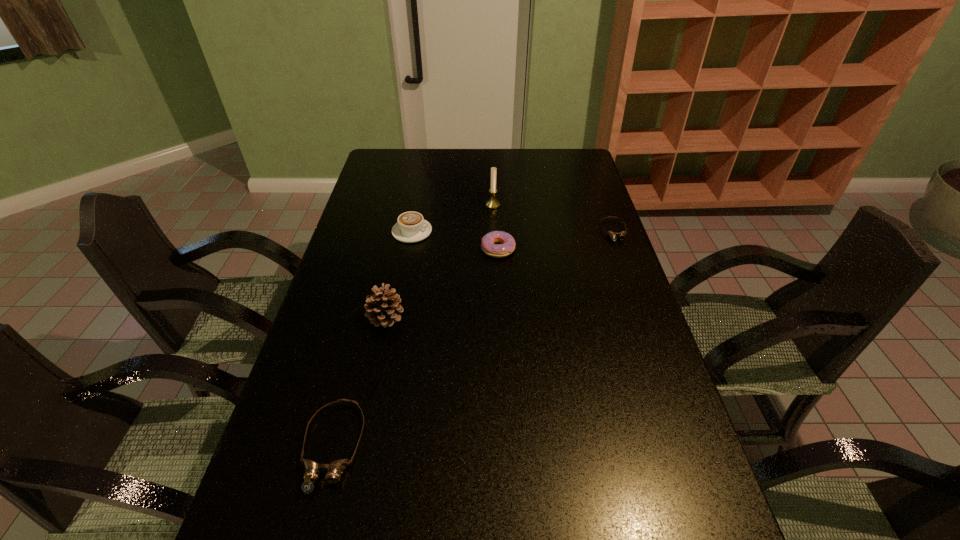
Where is `vacant area at the far edge of the desktop`? vacant area at the far edge of the desktop is located at coordinates (547, 175).

Identify the location of free point at the left edge. The width and height of the screenshot is (960, 540). (313, 328).

Locate an element on the screen. The height and width of the screenshot is (540, 960). blank space at the right edge of the desktop is located at coordinates (594, 235).

This screenshot has height=540, width=960. What are the coordinates of `vacant space at the far left corner of the desktop` in the screenshot? It's located at (376, 163).

Locate an element on the screen. blank area at the far right corner is located at coordinates (570, 152).

This screenshot has width=960, height=540. What are the coordinates of `vacant point located between the fourth tallest object and the fifth shortest object` in the screenshot? It's located at (442, 283).

Where is `free space between the shorter goggles and the taller goggles`? The height and width of the screenshot is (540, 960). free space between the shorter goggles and the taller goggles is located at coordinates (473, 339).

Where is `vacant space that's between the third shortest object and the candle holder`? The height and width of the screenshot is (540, 960). vacant space that's between the third shortest object and the candle holder is located at coordinates (495, 227).

Where is `vacant space that's between the second tallest object and the cappuccino`? Image resolution: width=960 pixels, height=540 pixels. vacant space that's between the second tallest object and the cappuccino is located at coordinates (399, 274).

You are a GUI agent. You are given a task and a screenshot of the screen. Output one action in this format:
    pyautogui.click(x=<x>, y=<y>)
    Task: Click on the unoccupied area between the shortest object and the pinecone
    This screenshot has height=540, width=960.
    Given the screenshot: What is the action you would take?
    pyautogui.click(x=500, y=274)